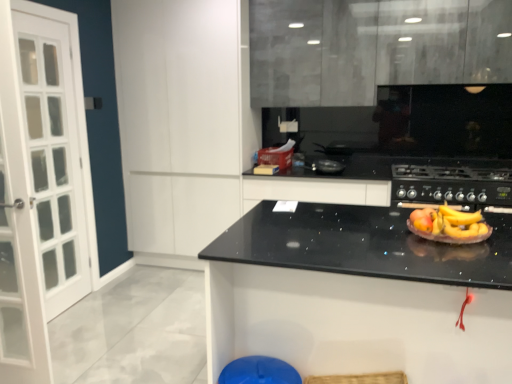
Find the location of a particular element. empty space that is ontop of matte black paper plate at center (from a real-world perspective) is located at coordinates (453, 228).